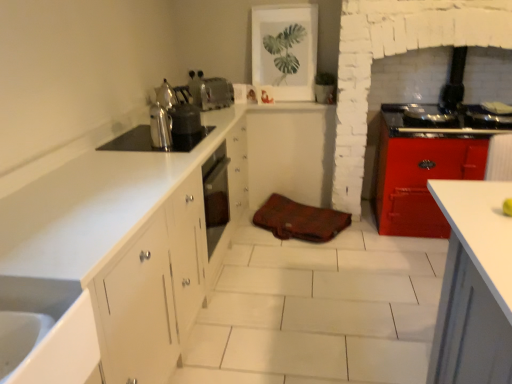
Question: Could you tell me if brown leather bag at center is turned towards satin silver kettle at upper left, the 1th appliance in the front-to-back sequence?

Choices:
 (A) yes
 (B) no

Answer: (B)

Question: Considering the relative positions of brown leather bag at center and satin silver kettle at upper left, the third appliance in the back-to-front sequence, in the image provided, is brown leather bag at center to the left of satin silver kettle at upper left, the third appliance in the back-to-front sequence, from the viewer's perspective?

Choices:
 (A) yes
 (B) no

Answer: (B)

Question: From a real-world perspective, is brown leather bag at center on top of satin silver kettle at upper left, the 1th appliance in the front-to-back sequence?

Choices:
 (A) no
 (B) yes

Answer: (A)

Question: Considering the relative sizes of brown leather bag at center and satin silver kettle at upper left, the third appliance in the back-to-front sequence, in the image provided, is brown leather bag at center shorter than satin silver kettle at upper left, the third appliance in the back-to-front sequence,?

Choices:
 (A) yes
 (B) no

Answer: (B)

Question: From the image's perspective, is brown leather bag at center located above satin silver kettle at upper left, the 1th appliance in the front-to-back sequence?

Choices:
 (A) yes
 (B) no

Answer: (B)

Question: From a real-world perspective, is brown leather bag at center below satin silver kettle at upper left, the 1th appliance in the front-to-back sequence?

Choices:
 (A) no
 (B) yes

Answer: (B)

Question: Does satin silver toaster at upper center, the 1th appliance positioned from the back, have a lesser height compared to shiny metallic kettle at center-left?

Choices:
 (A) yes
 (B) no

Answer: (A)

Question: Does satin silver toaster at upper center, the 1th appliance positioned from the back, lie behind shiny metallic kettle at center-left?

Choices:
 (A) yes
 (B) no

Answer: (A)

Question: Can you confirm if satin silver toaster at upper center, the 1th appliance positioned from the back, is taller than shiny metallic kettle at center-left?

Choices:
 (A) no
 (B) yes

Answer: (A)

Question: From the image's perspective, is satin silver toaster at upper center, the 3th appliance from the front, over shiny metallic kettle at center-left?

Choices:
 (A) yes
 (B) no

Answer: (A)

Question: Can you confirm if satin silver toaster at upper center, the 3th appliance from the front, is smaller than shiny metallic kettle at center-left?

Choices:
 (A) yes
 (B) no

Answer: (B)

Question: Considering the relative sizes of satin silver toaster at upper center, the 3th appliance from the front, and shiny metallic kettle at center-left in the image provided, is satin silver toaster at upper center, the 3th appliance from the front, thinner than shiny metallic kettle at center-left?

Choices:
 (A) no
 (B) yes

Answer: (A)

Question: From a real-world perspective, is shiny metallic tea pot at upper left physically below white matte cabinet at center?

Choices:
 (A) yes
 (B) no

Answer: (B)